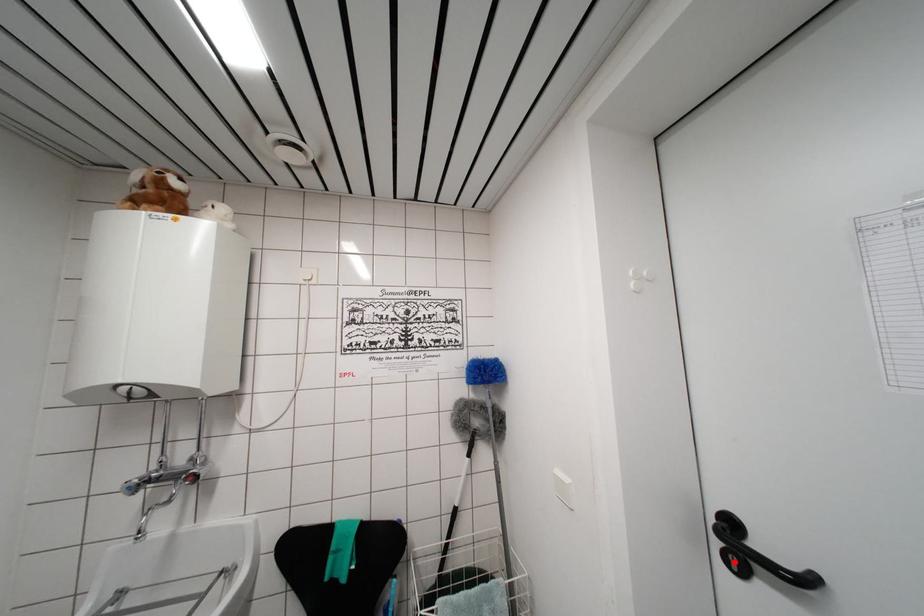
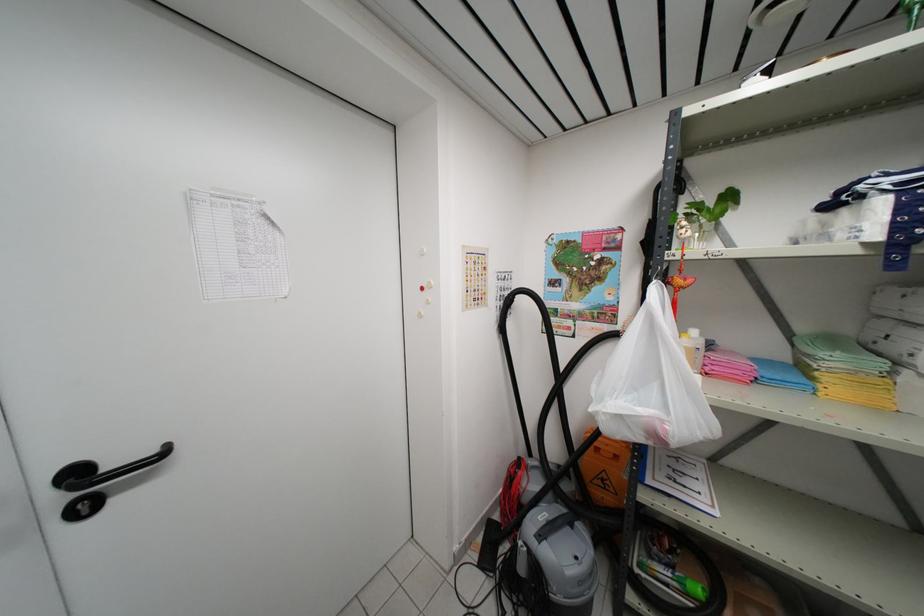
Where in the second image is the point corresponding to the highlighted location from the first image?

(83, 512)